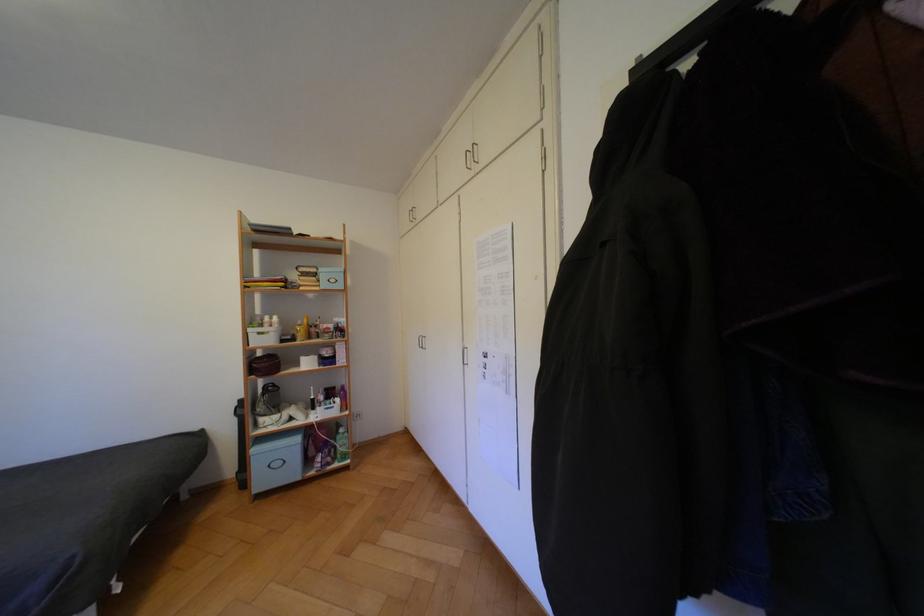
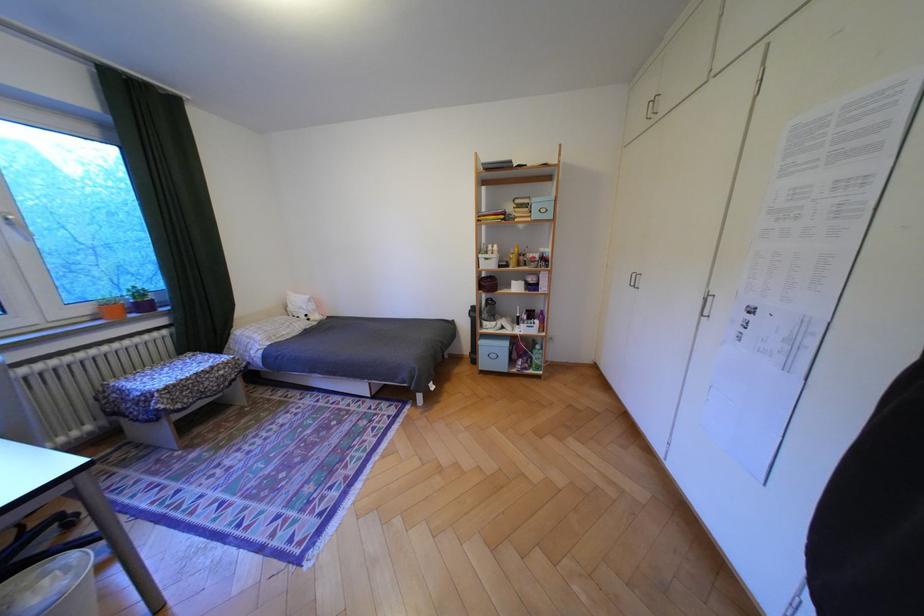
Where in the second image is the point corresponding to point 272,230 from the first image?

(501, 168)